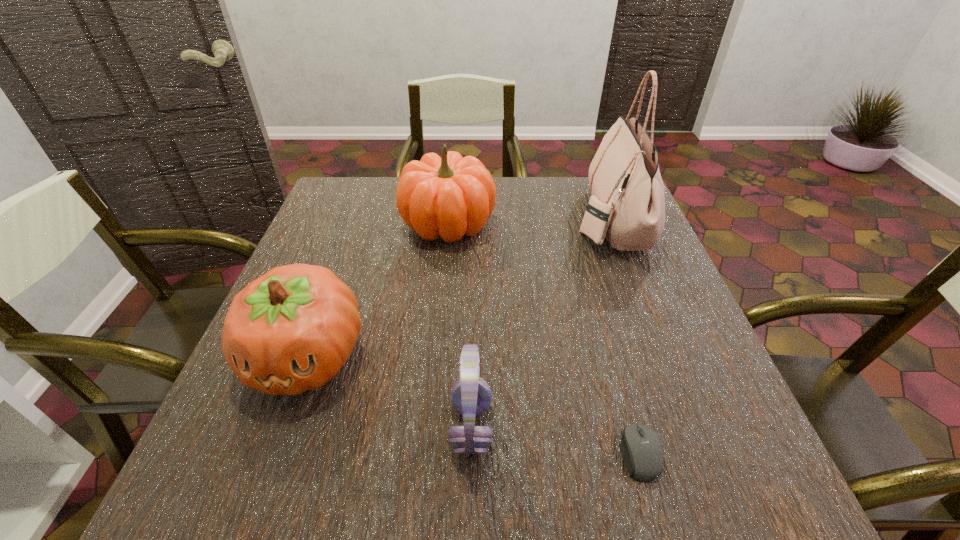
Locate an element on the screen. empty location between the headset and the nearer pumpkin is located at coordinates (389, 392).

Where is `blank region between the headset and the farther pumpkin`? This screenshot has height=540, width=960. blank region between the headset and the farther pumpkin is located at coordinates (460, 325).

The width and height of the screenshot is (960, 540). What are the coordinates of `free spot between the shortest object and the right pumpkin` in the screenshot? It's located at (543, 338).

I want to click on free space between the handbag and the nearer pumpkin, so click(x=458, y=288).

Where is `unoccupied area between the tallest object and the second shortest object`? This screenshot has height=540, width=960. unoccupied area between the tallest object and the second shortest object is located at coordinates (540, 323).

I want to click on free spot between the headset and the farther pumpkin, so click(x=460, y=325).

The height and width of the screenshot is (540, 960). Find the location of `empty location between the handbag and the headset`. empty location between the handbag and the headset is located at coordinates (540, 323).

Identify the location of empty space between the right pumpkin and the left pumpkin. [x=377, y=290].

Locate which object ranks fourth in proximity to the headset. Please provide its 2D coordinates. Your answer should be formatted as a tuple, i.e. [(x, y)], where the tuple contains the x and y coordinates of a point satisfying the conditions above.

[(627, 205)]

This screenshot has height=540, width=960. Identify the location of the third closest object to the right pumpkin. (471, 396).